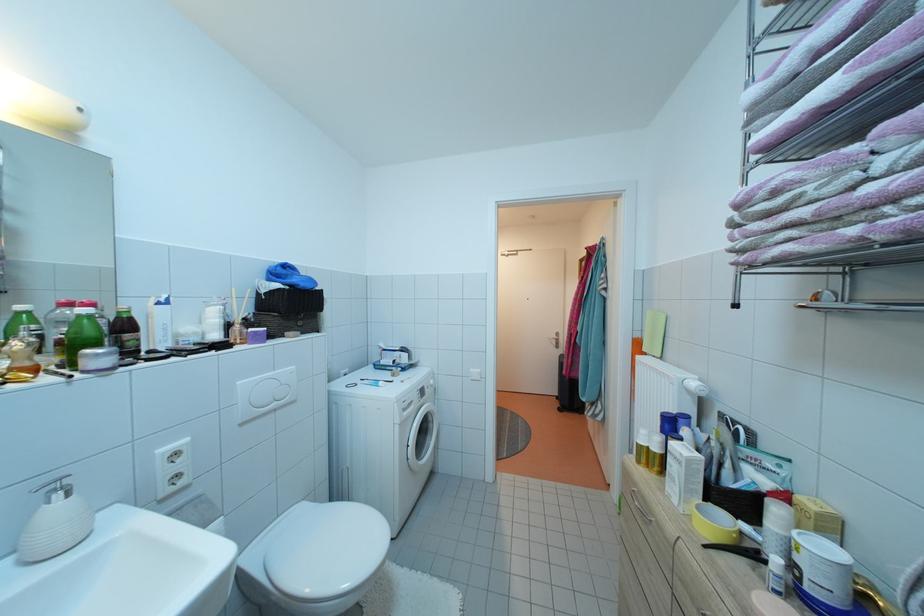
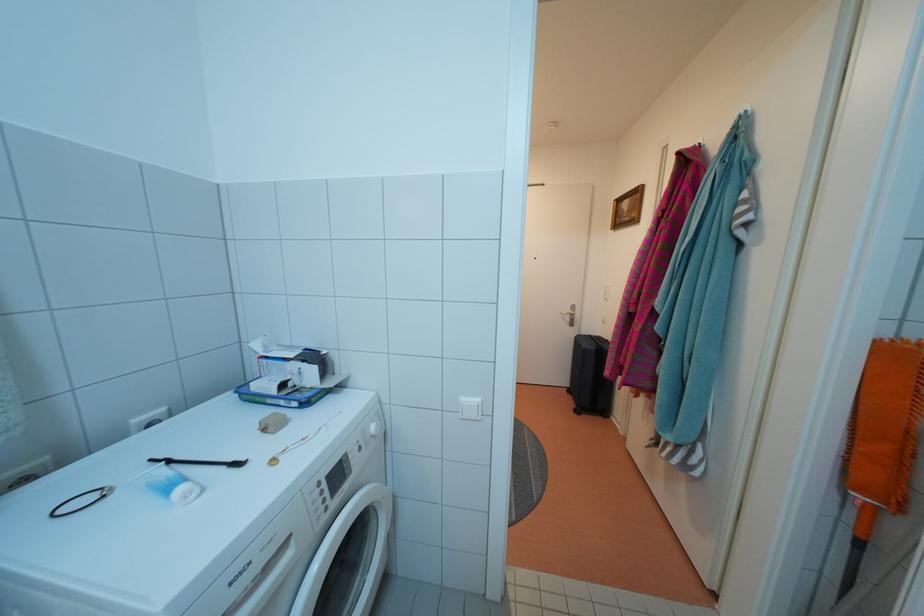
In the second image, find the point that corresponds to pixel 482 377 in the first image.

(478, 408)